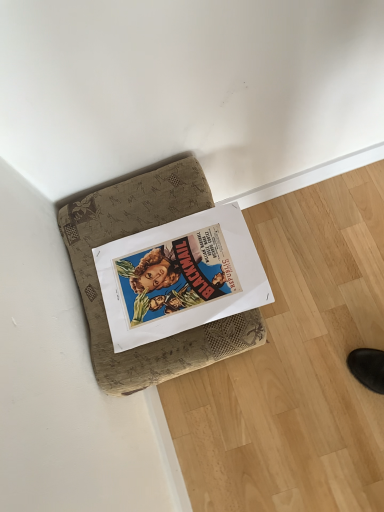
Find the location of `brown fabric cushion at upper center`. brown fabric cushion at upper center is located at coordinates (134, 233).

The height and width of the screenshot is (512, 384). What do you see at coordinates (134, 233) in the screenshot? I see `brown fabric cushion at upper center` at bounding box center [134, 233].

The image size is (384, 512). In order to click on brown fabric cushion at upper center in this screenshot , I will do `click(134, 233)`.